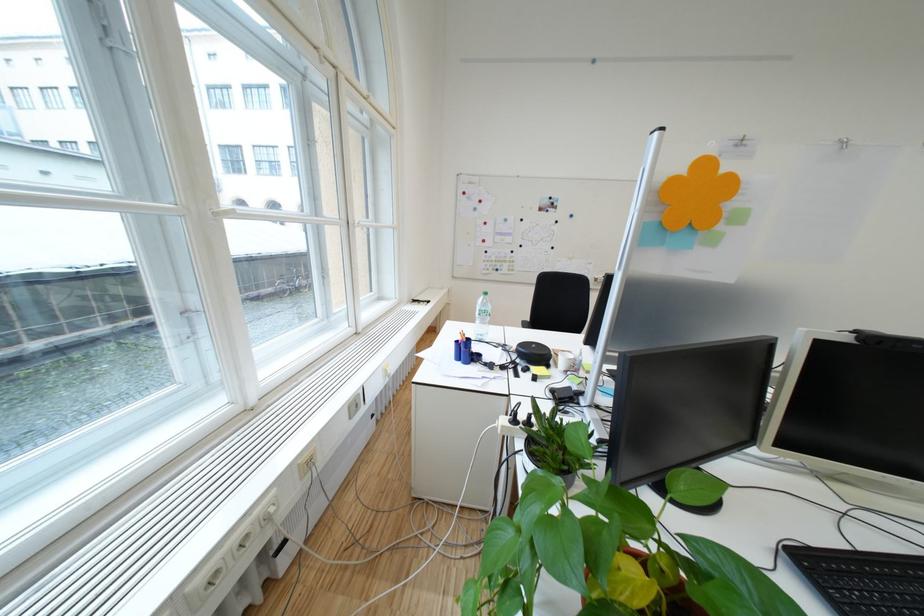
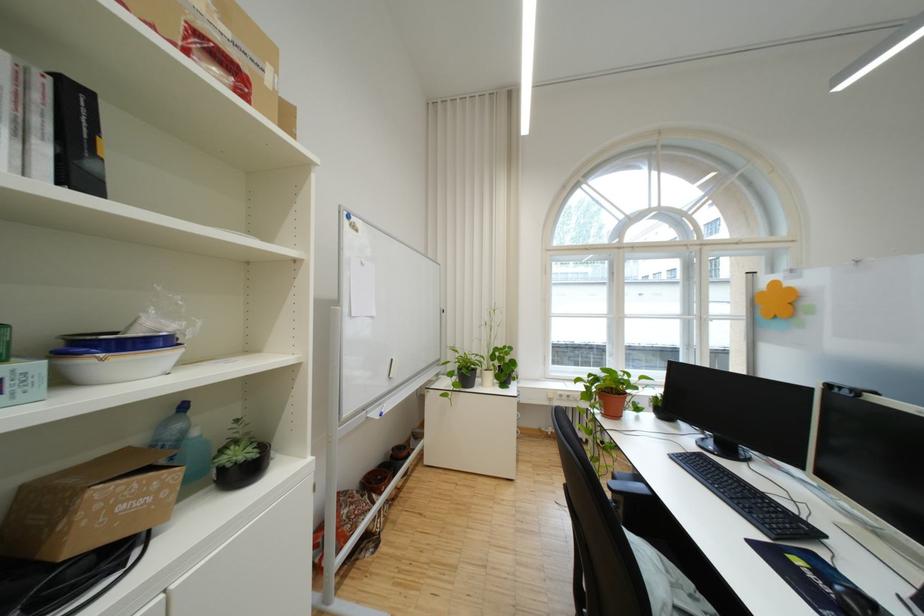
Question: I am providing you with two images of the same scene from different viewpoints. Which of the following objects are not visible in image2?

Choices:
 (A) plastic water bottle
 (B) black seat surface
 (C) white and blue bowl
 (D) small cardboard box

Answer: (A)